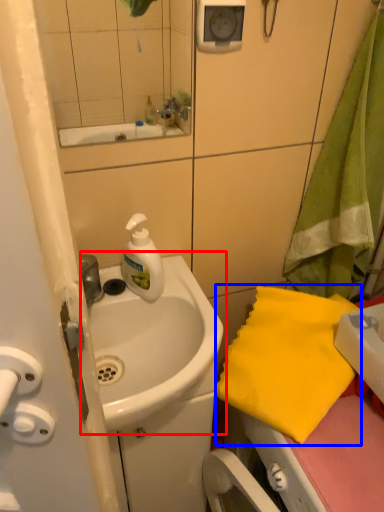
Question: Which object appears closest to the camera in this image, sink (highlighted by a red box) or beach towel (highlighted by a blue box)?

Choices:
 (A) sink
 (B) beach towel

Answer: (A)